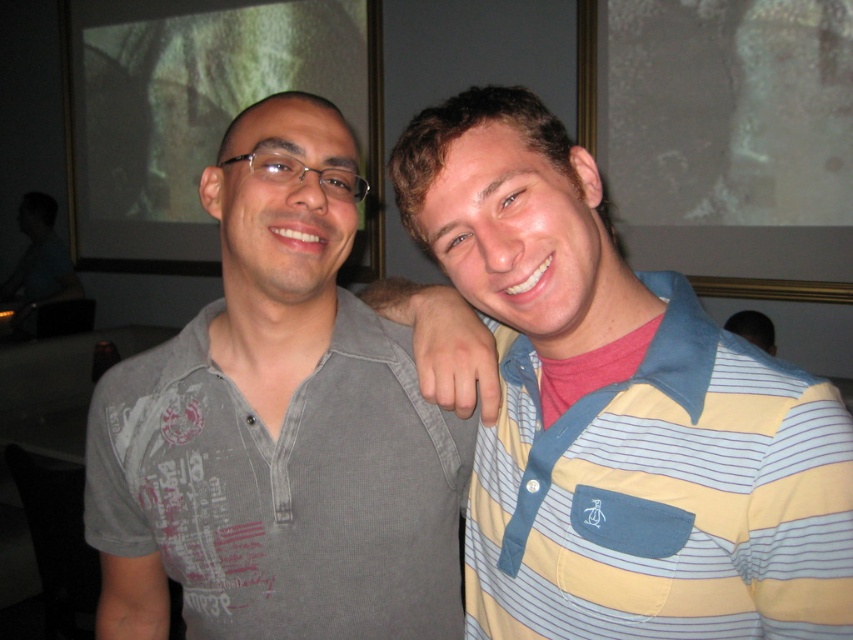
Which of these two, gray cotton shirt at left or yellow and blue striped polo shirt at right, stands shorter?

With less height is yellow and blue striped polo shirt at right.

Who is more distant from viewer, (312, 134) or (824, 438)?

Positioned behind is point (312, 134).

Is point (244, 577) closer to camera compared to point (486, 522)?

Yes, it is in front of point (486, 522).

This screenshot has height=640, width=853. Identify the location of gray cotton shirt at left. pos(277,428).